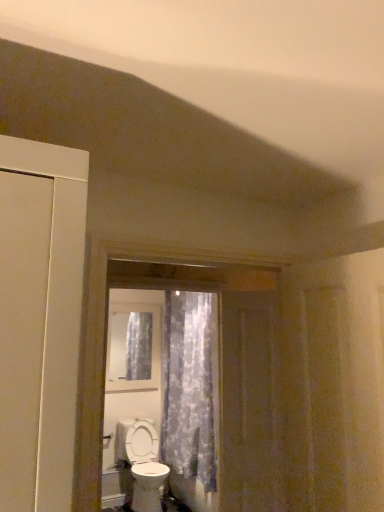
Measure the distance between brown wooden screen door at center and camera.

2.62 meters.

Describe the element at coordinates (133, 347) in the screenshot. I see `clear glass window at center` at that location.

Find the location of `brown wooden screen door at center`. brown wooden screen door at center is located at coordinates (249, 404).

Considering the relative sizes of clear glass window at center and white glossy toilet at lower center in the image provided, is clear glass window at center smaller than white glossy toilet at lower center?

Indeed, clear glass window at center has a smaller size compared to white glossy toilet at lower center.

Is clear glass window at center taller or shorter than white glossy toilet at lower center?

Clearly, clear glass window at center is taller compared to white glossy toilet at lower center.

Is point (120, 370) closer to viewer compared to point (131, 474)?

No, it is behind (131, 474).

From the image's perspective, which one is positioned higher, clear glass window at center or translucent floral fabric at center?

clear glass window at center, from the image's perspective.

From a real-world perspective, between clear glass window at center and translucent floral fabric at center, who is vertically lower?

translucent floral fabric at center.

Between clear glass window at center and translucent floral fabric at center, which one has larger size?

Bigger between the two is translucent floral fabric at center.

Does point (112, 339) appear closer or farther from the camera than point (212, 301)?

Point (112, 339).

At what (x,y) coordinates should I click in order to perform the action: click on screen door that appears on the right of translucent floral fabric at center. Please return your answer as a coordinate pair (x, y). The image size is (384, 512). Looking at the image, I should click on (249, 404).

From the image's perspective, is brown wooden screen door at center below translucent floral fabric at center?

Incorrect, from the image's perspective, brown wooden screen door at center is higher than translucent floral fabric at center.

From the picture: Considering the sizes of brown wooden screen door at center and translucent floral fabric at center in the image, is brown wooden screen door at center bigger or smaller than translucent floral fabric at center?

Considering their sizes, brown wooden screen door at center takes up less space than translucent floral fabric at center.

Is translucent floral fabric at center located within brown wooden screen door at center?

Actually, translucent floral fabric at center is outside brown wooden screen door at center.

Looking at this image, measure the distance between translucent floral fabric at center and brown wooden screen door at center.

translucent floral fabric at center and brown wooden screen door at center are 3.62 feet apart.

The width and height of the screenshot is (384, 512). I want to click on curtain below the brown wooden screen door at center (from the image's perspective), so click(189, 387).

Is translucent floral fabric at center facing towards brown wooden screen door at center?

No, translucent floral fabric at center is not aimed at brown wooden screen door at center.

From a real-world perspective, between translucent floral fabric at center and brown wooden screen door at center, who is vertically lower?

translucent floral fabric at center.

Can you confirm if white glossy toilet at lower center is positioned to the right of brown wooden screen door at center?

No, white glossy toilet at lower center is not to the right of brown wooden screen door at center.

Is white glossy toilet at lower center wider than brown wooden screen door at center?

Result: Correct, the width of white glossy toilet at lower center exceeds that of brown wooden screen door at center.

You are a GUI agent. You are given a task and a screenshot of the screen. Output one action in this format:
    pyautogui.click(x=<x>, y=<y>)
    Task: Click on the screen door in front of the white glossy toilet at lower center
    
    Given the screenshot: What is the action you would take?
    pyautogui.click(x=249, y=404)

Can you confirm if translucent floral fabric at center is wider than white glossy toilet at lower center?

No, translucent floral fabric at center is not wider than white glossy toilet at lower center.

How different are the orientations of translucent floral fabric at center and white glossy toilet at lower center in degrees?

The angular difference between translucent floral fabric at center and white glossy toilet at lower center is 85.9 degrees.

Is point (212, 416) closer to camera compared to point (132, 444)?

Yes.

In the scene shown: Can you confirm if translucent floral fabric at center is smaller than white glossy toilet at lower center?

Incorrect, translucent floral fabric at center is not smaller in size than white glossy toilet at lower center.

Can you confirm if brown wooden screen door at center is wider than white glossy toilet at lower center?

No.

Identify the location of toilet below the brown wooden screen door at center (from a real-world perspective). This screenshot has height=512, width=384. (142, 463).

Is brown wooden screen door at center situated inside white glossy toilet at lower center or outside?

brown wooden screen door at center is not inside white glossy toilet at lower center, it's outside.

Which is closer to the camera, (230,347) or (145,511)?

The point (230,347) is closer.

Where is `toilet below the clear glass window at center (from the image's perspective)`? The width and height of the screenshot is (384, 512). toilet below the clear glass window at center (from the image's perspective) is located at coordinates (142, 463).

I want to click on window above the translucent floral fabric at center (from a real-world perspective), so click(x=133, y=347).

Considering their positions, is brown wooden screen door at center positioned further to clear glass window at center than translucent floral fabric at center?

brown wooden screen door at center is positioned further to the anchor clear glass window at center.

Based on their spatial positions, is clear glass window at center or brown wooden screen door at center closer to white glossy toilet at lower center?

Based on the image, clear glass window at center appears to be nearer to white glossy toilet at lower center.

Consider the image. Which object lies nearer to the anchor point brown wooden screen door at center, translucent floral fabric at center or white glossy toilet at lower center?

The object closer to brown wooden screen door at center is translucent floral fabric at center.

From the image, which object appears to be nearer to white glossy toilet at lower center, clear glass window at center or translucent floral fabric at center?

Among the two, translucent floral fabric at center is located nearer to white glossy toilet at lower center.

When comparing their distances from white glossy toilet at lower center, does brown wooden screen door at center or clear glass window at center seem further?

Based on the image, brown wooden screen door at center appears to be further to white glossy toilet at lower center.

Considering their positions, is white glossy toilet at lower center positioned closer to translucent floral fabric at center than brown wooden screen door at center?

white glossy toilet at lower center is positioned closer to the anchor translucent floral fabric at center.

Estimate the real-world distances between objects in this image. Which object is closer to clear glass window at center, brown wooden screen door at center or white glossy toilet at lower center?

Among the two, white glossy toilet at lower center is located nearer to clear glass window at center.

Considering their positions, is clear glass window at center positioned closer to brown wooden screen door at center than white glossy toilet at lower center?

Based on the image, white glossy toilet at lower center appears to be nearer to brown wooden screen door at center.

Identify the location of curtain positioned between brown wooden screen door at center and clear glass window at center from near to far. The width and height of the screenshot is (384, 512). (189, 387).

At what (x,y) coordinates should I click in order to perform the action: click on curtain between clear glass window at center and white glossy toilet at lower center vertically. Please return your answer as a coordinate pair (x, y). The image size is (384, 512). Looking at the image, I should click on (189, 387).

Where is `curtain positioned between brown wooden screen door at center and white glossy toilet at lower center from near to far`? curtain positioned between brown wooden screen door at center and white glossy toilet at lower center from near to far is located at coordinates (189, 387).

Image resolution: width=384 pixels, height=512 pixels. I want to click on toilet between brown wooden screen door at center and clear glass window at center in the front-back direction, so click(x=142, y=463).